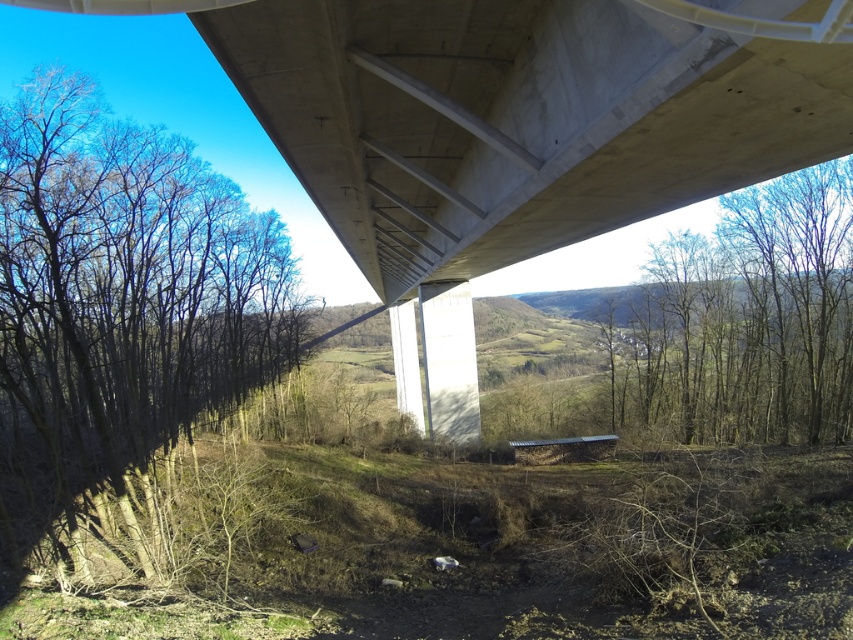
You are an urban planner assessing the structural integrity of the bridge. You notice the concrete at upper center and the bare branches at left in the image. Which of these two elements is bigger in size?

The concrete at upper center is larger in size compared to the bare branches at left.

You are standing at the base of the large concrete bridge structure. Looking up, you notice a specific point marked at coordinates (515, 129). What material is located at this point on the bridge structure?

The point at coordinates (515, 129) marks concrete at upper center.

You are standing under the bridge and want to walk towards the bright blue sky. Which direction should you go to avoid the bare wood trees at upper right and the bare branches at left?

To avoid both the bare wood trees at upper right and the bare branches at left, you should walk towards the center of the bridge since the bare branches at left is to the left of the bare wood trees at upper right, implying they are positioned on opposite sides.